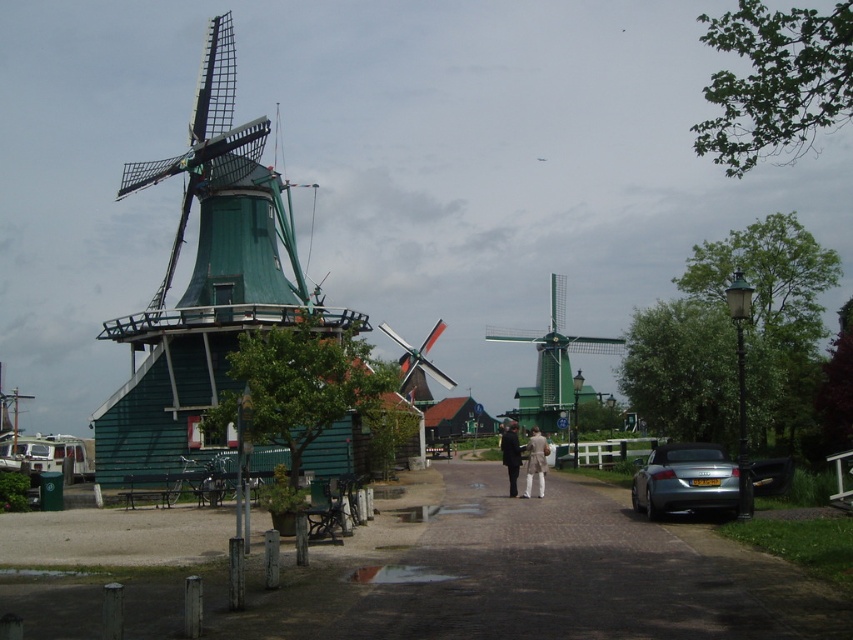
You are a tour guide leading a group to the main windmill. You need to move your beige fabric coat at center to the silver metallic car at lower right. Is there enough space for the coat in the car?

The silver metallic car at lower right occupies less space than beige fabric coat at center, so the coat may not fit inside the car due to the car being smaller in size.

You are standing at the entrance of the Dutch windmill area and see two points marked in the image. Which point, point (x=489, y=605) or point (x=520, y=388), is closer to you?

Point (x=489, y=605) is closer to the viewer than point (x=520, y=388).

In the scene shown: You are standing at the entrance of the Dutch windmill area and want to place a decorative stone exactly at the center of the dark brown cobblestone at center. What are the coordinates where you should place it?

The coordinates for the dark brown cobblestone at center are at point [579,573], so you should place the decorative stone there.